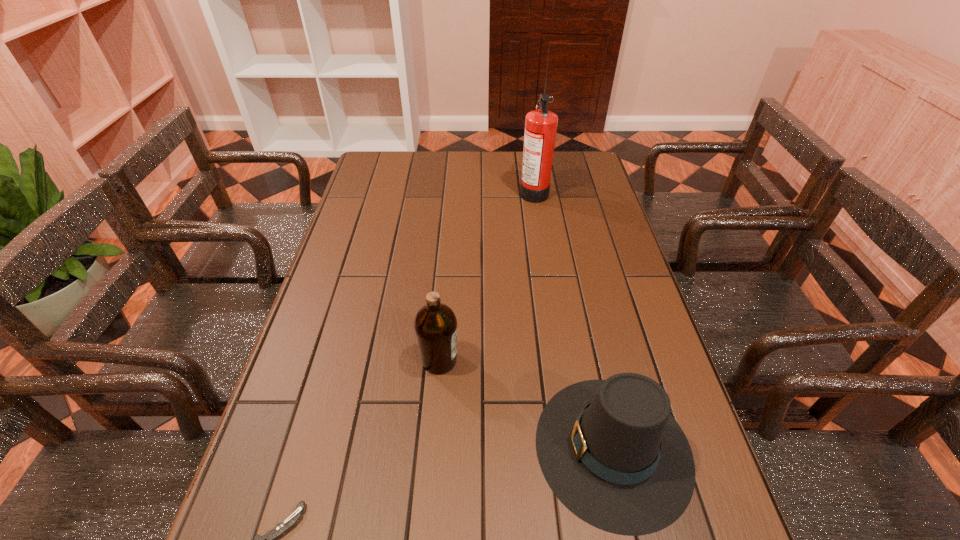
Where is `unoccupied area between the hat and the tallest object`? This screenshot has width=960, height=540. unoccupied area between the hat and the tallest object is located at coordinates [x=573, y=320].

I want to click on object that is the third closest to the third object from right to left, so click(541, 124).

Find the location of a particular element. This screenshot has height=540, width=960. object identified as the second closest to the third tallest object is located at coordinates point(270,538).